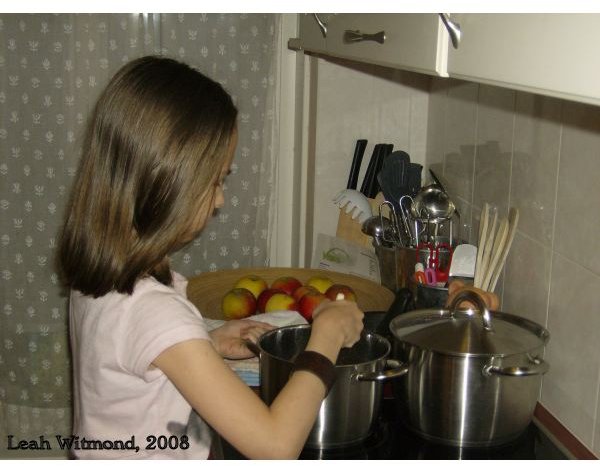
This screenshot has width=600, height=466. Identify the location of cabinet. (398, 46), (476, 48).